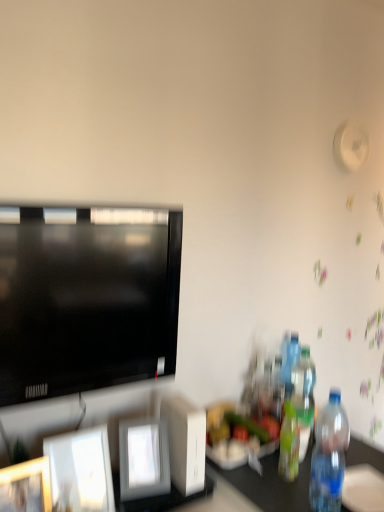
Question: Does translucent plastic bottle at right, which is the second bottle from front to back, have a greater width compared to transparent plastic bottle at right, which ranks as the 1th bottle in front-to-back order?

Choices:
 (A) yes
 (B) no

Answer: (B)

Question: From a real-world perspective, is translucent plastic bottle at right, which is the second bottle from front to back, located higher than transparent plastic bottle at right, which ranks as the 1th bottle in front-to-back order?

Choices:
 (A) no
 (B) yes

Answer: (A)

Question: Considering the relative sizes of translucent plastic bottle at right, the 3th bottle viewed from the back, and transparent plastic bottle at right, the fourth bottle in the back-to-front sequence, in the image provided, is translucent plastic bottle at right, the 3th bottle viewed from the back, thinner than transparent plastic bottle at right, the fourth bottle in the back-to-front sequence,?

Choices:
 (A) yes
 (B) no

Answer: (A)

Question: From a real-world perspective, is translucent plastic bottle at right, which is the second bottle from front to back, located beneath transparent plastic bottle at right, the fourth bottle in the back-to-front sequence?

Choices:
 (A) no
 (B) yes

Answer: (B)

Question: From the image's perspective, does translucent plastic bottle at right, the 3th bottle viewed from the back, appear lower than transparent plastic bottle at right, which ranks as the 1th bottle in front-to-back order?

Choices:
 (A) yes
 (B) no

Answer: (A)

Question: From the image's perspective, is translucent plastic bottle at right, the 3th bottle viewed from the back, positioned above or below translucent plastic bottle at right, the 4th bottle viewed from the front?

Choices:
 (A) below
 (B) above

Answer: (A)

Question: Looking at the image, does translucent plastic bottle at right, which is the second bottle from front to back, seem bigger or smaller compared to translucent plastic bottle at right, marked as the 1th bottle in a back-to-front arrangement?

Choices:
 (A) big
 (B) small

Answer: (B)

Question: From a real-world perspective, is translucent plastic bottle at right, the 3th bottle viewed from the back, positioned above or below translucent plastic bottle at right, marked as the 1th bottle in a back-to-front arrangement?

Choices:
 (A) below
 (B) above

Answer: (A)

Question: Considering their positions, is translucent plastic bottle at right, the 3th bottle viewed from the back, located in front of or behind translucent plastic bottle at right, marked as the 1th bottle in a back-to-front arrangement?

Choices:
 (A) front
 (B) behind

Answer: (A)

Question: From the image's perspective, is translucent plastic bottle at right, marked as the 1th bottle in a back-to-front arrangement, above or below translucent plastic bottle at right, the 3th bottle viewed from the back?

Choices:
 (A) below
 (B) above

Answer: (B)

Question: Is point pyautogui.click(x=288, y=347) positioned closer to the camera than point pyautogui.click(x=284, y=438)?

Choices:
 (A) farther
 (B) closer

Answer: (A)

Question: Looking at the image, does translucent plastic bottle at right, the 4th bottle viewed from the front, seem bigger or smaller compared to translucent plastic bottle at right, which is the second bottle from front to back?

Choices:
 (A) big
 (B) small

Answer: (A)

Question: Is translucent plastic bottle at right, marked as the 1th bottle in a back-to-front arrangement, inside the boundaries of translucent plastic bottle at right, the 3th bottle viewed from the back, or outside?

Choices:
 (A) outside
 (B) inside

Answer: (A)

Question: Does point (155, 487) appear closer or farther from the camera than point (24, 266)?

Choices:
 (A) farther
 (B) closer

Answer: (A)

Question: Considering the relative positions of white glossy picture frame at center, marked as the 1th picture frame in a right-to-left arrangement, and matte black television at left in the image provided, is white glossy picture frame at center, marked as the 1th picture frame in a right-to-left arrangement, to the left or to the right of matte black television at left?

Choices:
 (A) right
 (B) left

Answer: (A)